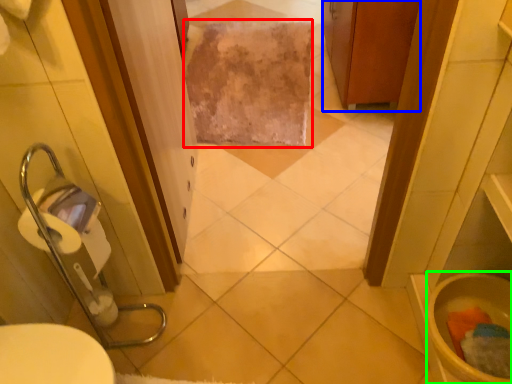
Question: Which object is the farthest from bath towel (highlighted by a red box)? Choose among these: cabinetry (highlighted by a blue box) or toilet bowl (highlighted by a green box).

Choices:
 (A) cabinetry
 (B) toilet bowl

Answer: (B)